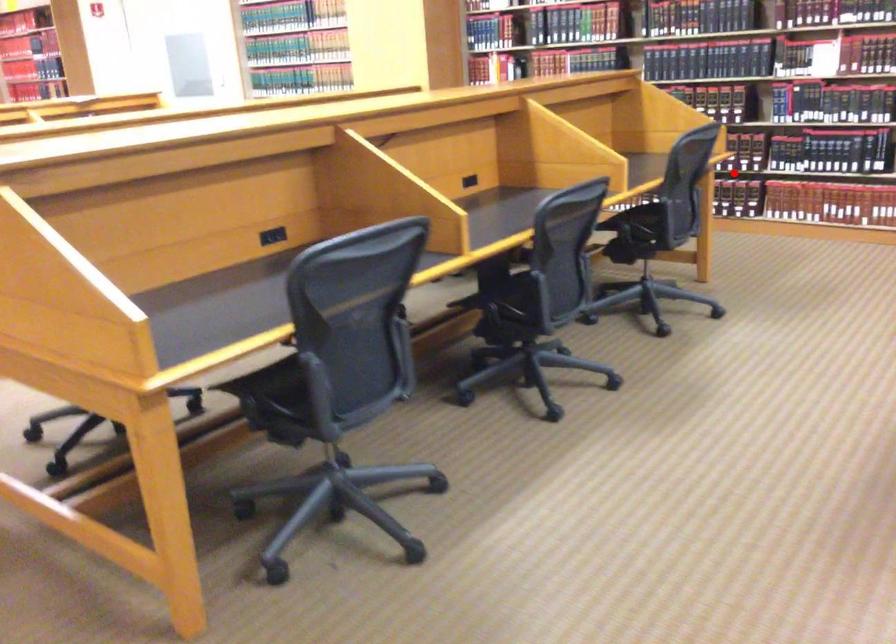
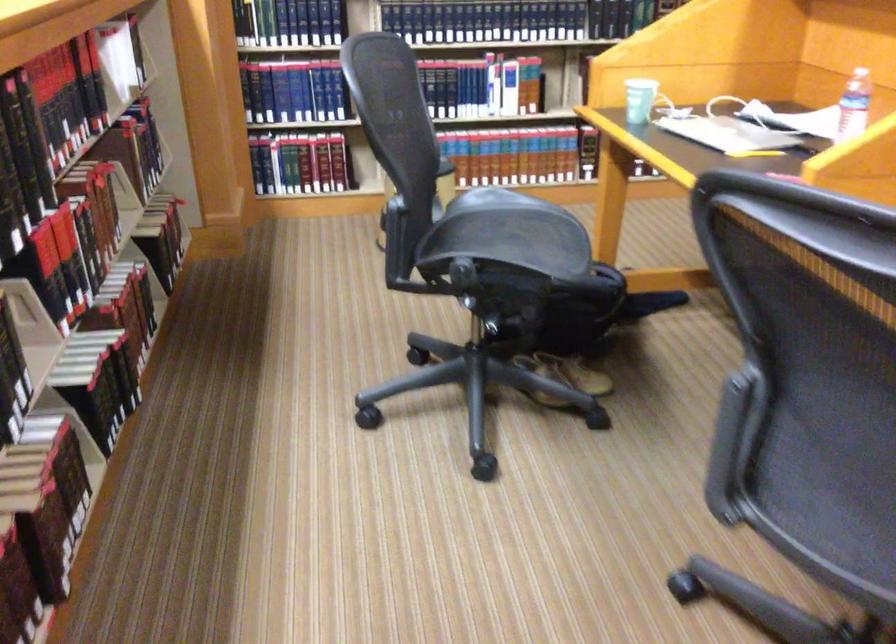
Question: I am providing you with two images of the same scene from different viewpoints. A red point is marked on the first image. Can you still see the location of the red point in image 2?

Choices:
 (A) Yes
 (B) No

Answer: (B)